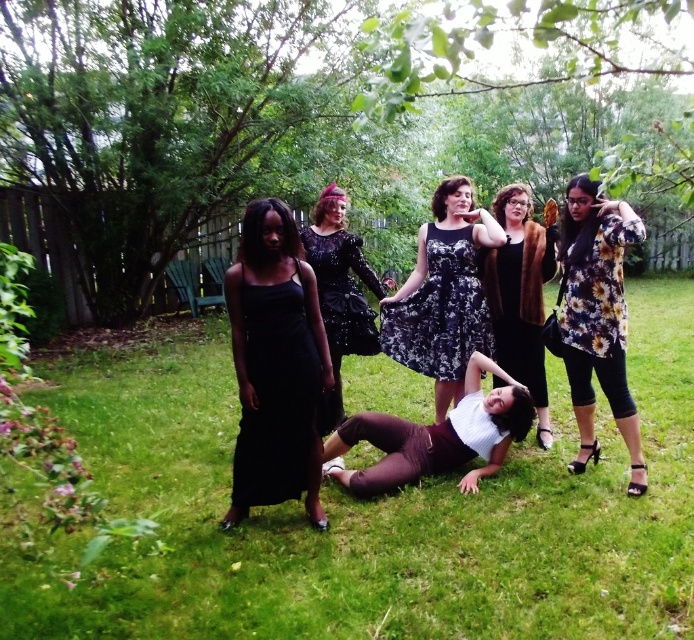
Question: Among these points, which one is nearest to the camera?

Choices:
 (A) (397, 333)
 (B) (604, 236)
 (C) (363, 349)

Answer: (B)

Question: Observing the image, what is the correct spatial positioning of floral print blouse at center in reference to fuzzy brown fur coat at center?

Choices:
 (A) above
 (B) below

Answer: (B)

Question: Considering the relative positions of floral print blouse at center and sparkly black dress at center in the image provided, where is floral print blouse at center located with respect to sparkly black dress at center?

Choices:
 (A) above
 (B) below

Answer: (B)

Question: Is white matte shirt at center to the right of black sequined dress at center from the viewer's perspective?

Choices:
 (A) no
 (B) yes

Answer: (B)

Question: Which object appears farthest from the camera in this image?

Choices:
 (A) white matte shirt at center
 (B) floral print blouse at center
 (C) black satin dress at left

Answer: (A)

Question: Which is farther from the black floral dress at center?

Choices:
 (A) black sequined dress at center
 (B) green grass at center
 (C) black satin dress at left
 (D) floral fabric blouse at right

Answer: (B)